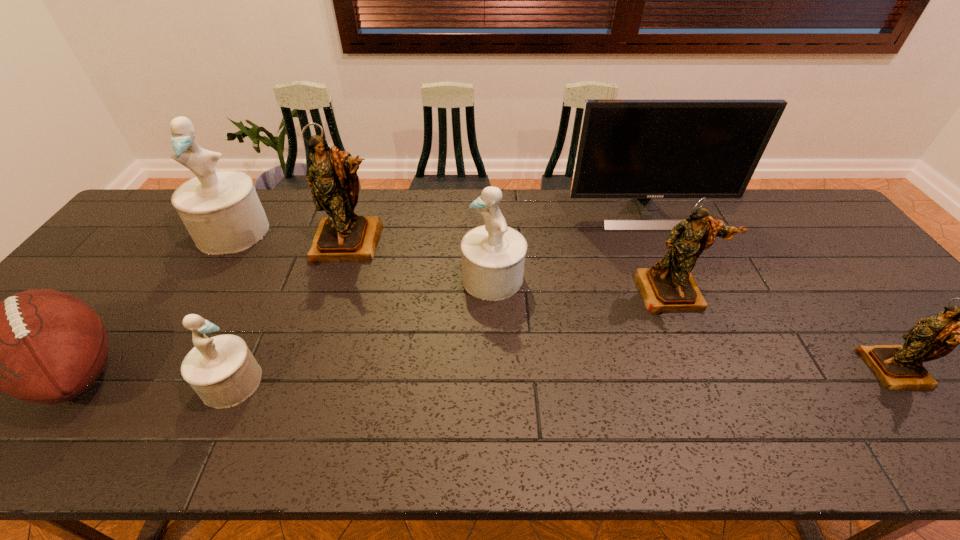
The height and width of the screenshot is (540, 960). Find the location of `monitor`. monitor is located at coordinates (642, 149).

Where is `the biggest white figurine`? The width and height of the screenshot is (960, 540). the biggest white figurine is located at coordinates (221, 210).

Where is `the leftmost white figurine`? Image resolution: width=960 pixels, height=540 pixels. the leftmost white figurine is located at coordinates (221, 210).

Locate an element on the screen. This screenshot has width=960, height=540. the leftmost gold figurine is located at coordinates click(343, 236).

Identify the location of the biggest gold figurine. The image size is (960, 540). (343, 236).

Locate an element on the screen. This screenshot has height=540, width=960. the second smallest white figurine is located at coordinates (492, 255).

You are a GUI agent. You are given a task and a screenshot of the screen. Output one action in this format:
    pyautogui.click(x=<x>, y=<y>)
    Task: Click on the fourth object from right to left
    
    Given the screenshot: What is the action you would take?
    pyautogui.click(x=492, y=255)

Locate an element on the screen. The image size is (960, 540). the second figurine from right to left is located at coordinates (669, 286).

Where is `the second gold figurine from right to left`? Image resolution: width=960 pixels, height=540 pixels. the second gold figurine from right to left is located at coordinates (669, 286).

Identify the location of the nearest gold figurine. (898, 367).